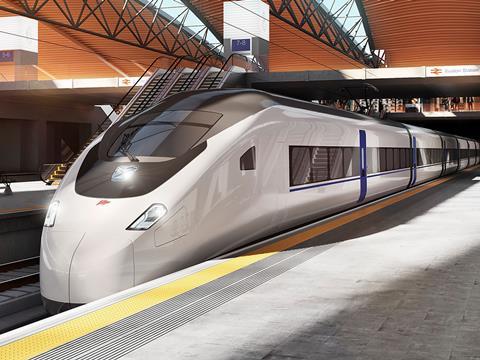
I want to click on stairs, so click(x=207, y=77), click(x=154, y=84).